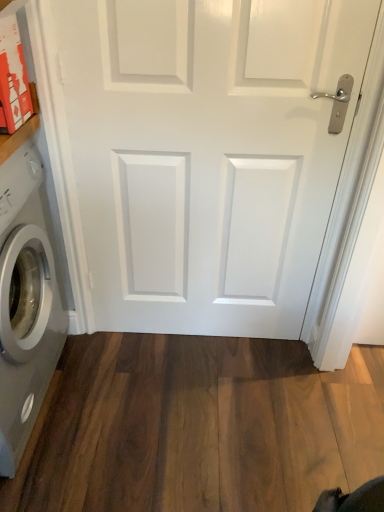
Question: Considering the relative sizes of white plastic washing machine at left and white glossy door at center in the image provided, is white plastic washing machine at left bigger than white glossy door at center?

Choices:
 (A) yes
 (B) no

Answer: (A)

Question: Is white plastic washing machine at left surrounding white glossy door at center?

Choices:
 (A) no
 (B) yes

Answer: (A)

Question: Does white plastic washing machine at left have a smaller size compared to white glossy door at center?

Choices:
 (A) no
 (B) yes

Answer: (A)

Question: Is white plastic washing machine at left taller than white glossy door at center?

Choices:
 (A) yes
 (B) no

Answer: (B)

Question: From a real-world perspective, is white plastic washing machine at left physically below white glossy door at center?

Choices:
 (A) yes
 (B) no

Answer: (A)

Question: In terms of size, does brown wood flooring at lower center appear bigger or smaller than white plastic washing machine at left?

Choices:
 (A) big
 (B) small

Answer: (B)

Question: Do you think brown wood flooring at lower center is within white plastic washing machine at left, or outside of it?

Choices:
 (A) inside
 (B) outside

Answer: (B)

Question: From the image's perspective, is brown wood flooring at lower center positioned above or below white plastic washing machine at left?

Choices:
 (A) below
 (B) above

Answer: (A)

Question: From a real-world perspective, is brown wood flooring at lower center physically located above or below white plastic washing machine at left?

Choices:
 (A) below
 (B) above

Answer: (A)

Question: From their relative heights in the image, would you say white plastic washing machine at left is taller or shorter than white glossy door at center?

Choices:
 (A) tall
 (B) short

Answer: (B)

Question: Is white plastic washing machine at left wider or thinner than white glossy door at center?

Choices:
 (A) wide
 (B) thin

Answer: (A)

Question: Considering their positions, is white plastic washing machine at left located in front of or behind white glossy door at center?

Choices:
 (A) behind
 (B) front

Answer: (B)

Question: Is white plastic washing machine at left to the left or to the right of white glossy door at center in the image?

Choices:
 (A) left
 (B) right

Answer: (A)

Question: From the image's perspective, is white plastic washing machine at left above or below brown wood flooring at lower center?

Choices:
 (A) below
 (B) above

Answer: (B)

Question: Considering the positions of white plastic washing machine at left and brown wood flooring at lower center in the image, is white plastic washing machine at left taller or shorter than brown wood flooring at lower center?

Choices:
 (A) short
 (B) tall

Answer: (B)